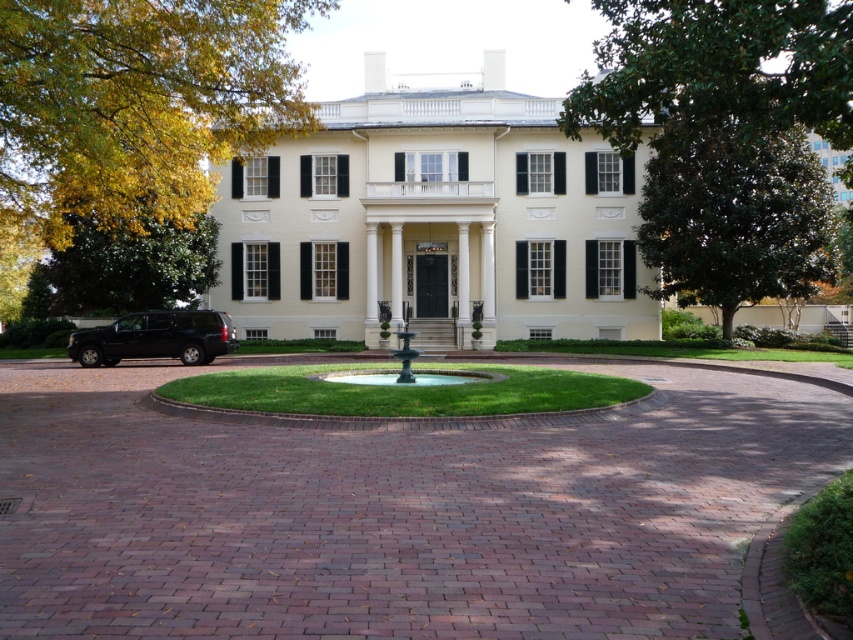
Does green leafy tree at upper right have a greater height compared to yellow leafy tree at upper left?

Indeed, green leafy tree at upper right has a greater height compared to yellow leafy tree at upper left.

Who is more distant from viewer, (747, 234) or (44, 218)?

Point (747, 234)

Image resolution: width=853 pixels, height=640 pixels. Describe the element at coordinates (724, 138) in the screenshot. I see `green leafy tree at upper right` at that location.

Where is `green leafy tree at upper right`? green leafy tree at upper right is located at coordinates (724, 138).

Can you confirm if brick at center is taller than green leafy tree at left?

In fact, brick at center may be shorter than green leafy tree at left.

In the scene shown: Which is above, brick at center or green leafy tree at left?

green leafy tree at left is higher up.

Which is in front, point (144, 596) or point (167, 276)?

Point (144, 596) is in front.

The image size is (853, 640). I want to click on brick at center, so click(x=393, y=513).

Which is below, brick at center or white matte building at center?

Positioned lower is brick at center.

Who is positioned more to the left, brick at center or white matte building at center?

white matte building at center

Which is behind, point (242, 452) or point (325, 168)?

Positioned behind is point (325, 168).

Locate an element on the screen. brick at center is located at coordinates (393, 513).